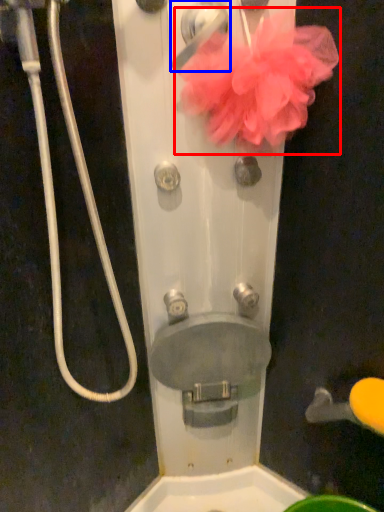
Question: Among these objects, which one is nearest to the camera, flower (highlighted by a red box) or door handle (highlighted by a blue box)?

Choices:
 (A) flower
 (B) door handle

Answer: (A)